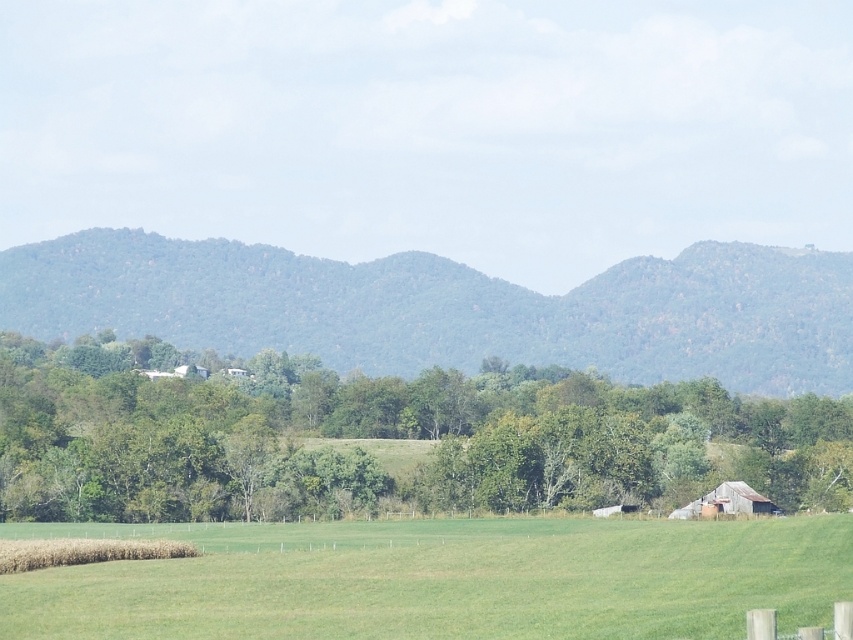
Question: Does green leafy tree at center have a smaller size compared to green grassy field at lower center?

Choices:
 (A) yes
 (B) no

Answer: (B)

Question: Which of the following is the closest to the observer?

Choices:
 (A) (845, 336)
 (B) (699, 605)

Answer: (B)

Question: Can you confirm if green leafy forest at center is bigger than green grassy field at lower center?

Choices:
 (A) no
 (B) yes

Answer: (B)

Question: Does green leafy tree at center appear under green leafy forest at center?

Choices:
 (A) yes
 (B) no

Answer: (A)

Question: Which is nearer to the green leafy tree at center?

Choices:
 (A) green leafy forest at center
 (B) green grassy field at lower center

Answer: (B)

Question: Which of the following is the closest to the observer?

Choices:
 (A) (202, 435)
 (B) (175, 531)

Answer: (B)